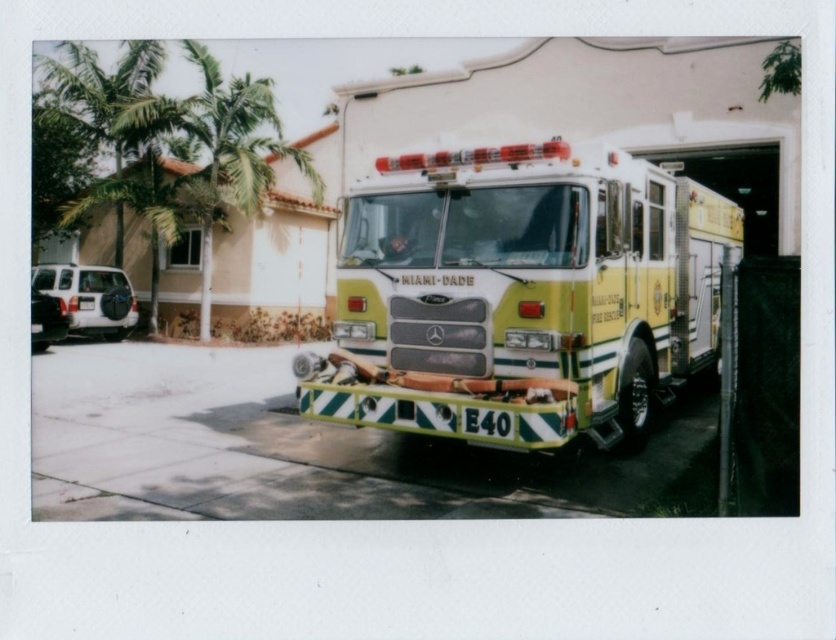
Does green leafy palm tree at upper left have a smaller size compared to white matte suv at left?

Actually, green leafy palm tree at upper left might be larger than white matte suv at left.

Can you confirm if green leafy palm tree at upper left is thinner than white matte suv at left?

Incorrect, green leafy palm tree at upper left's width is not less than white matte suv at left's.

Is point (238, 150) more distant than point (46, 241)?

No, it is not.

You are a GUI agent. You are given a task and a screenshot of the screen. Output one action in this format:
    pyautogui.click(x=<x>, y=<y>)
    Task: Click on the green leafy palm tree at upper left
    
    Given the screenshot: What is the action you would take?
    pyautogui.click(x=232, y=154)

Can you confirm if yellow-green glossy fire truck at center is positioned to the left of green leafy palm tree at left?

Incorrect, yellow-green glossy fire truck at center is not on the left side of green leafy palm tree at left.

Is yellow-green glossy fire truck at center above green leafy palm tree at left?

No.

Who is more forward, (401,161) or (39,54)?

Positioned in front is point (401,161).

Identify the location of yellow-green glossy fire truck at center. This screenshot has width=836, height=640. (520, 296).

Measure the distance between white matte suv at left and camera.

The distance of white matte suv at left from camera is 16.77 meters.

Does white matte suv at left have a larger size compared to matte black suv at lower left?

Actually, white matte suv at left might be smaller than matte black suv at lower left.

Where is `white matte suv at left`? The height and width of the screenshot is (640, 836). white matte suv at left is located at coordinates (85, 291).